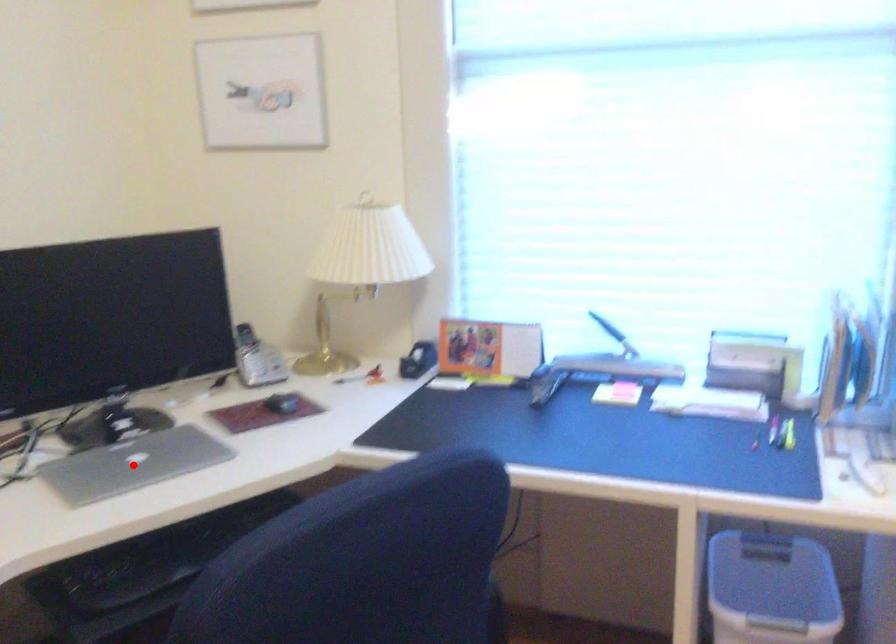
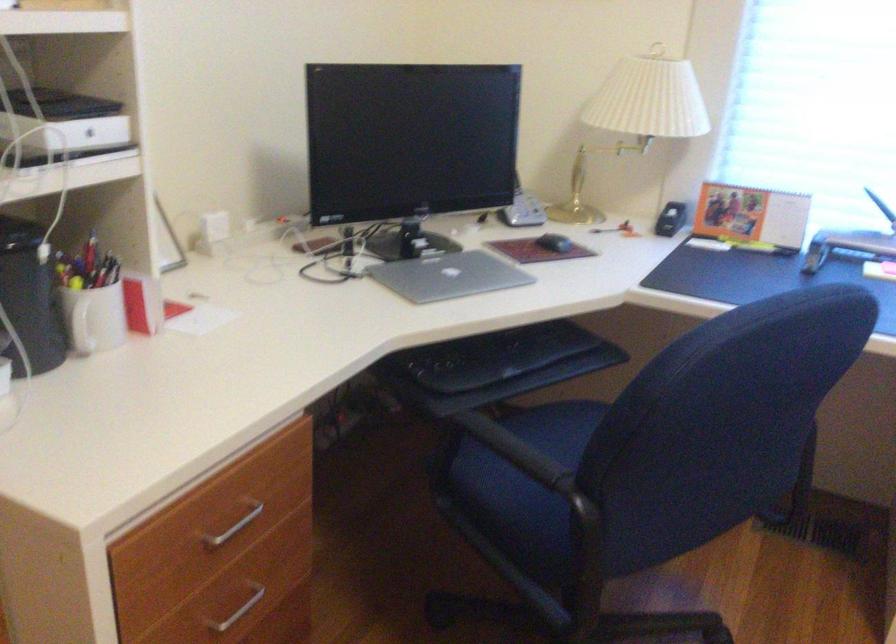
Locate, in the second image, the point that corresponds to the highlighted location in the first image.

(449, 276)